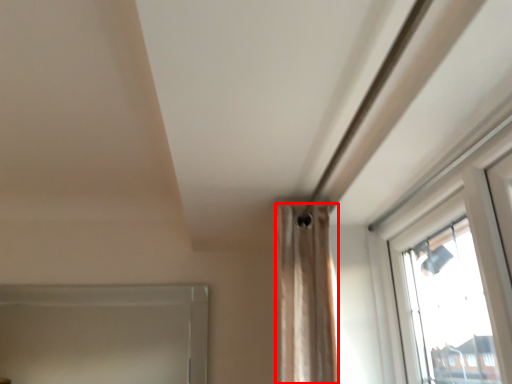
Question: Where is curtain (annotated by the red box) located in relation to window frame in the image?

Choices:
 (A) left
 (B) right

Answer: (B)